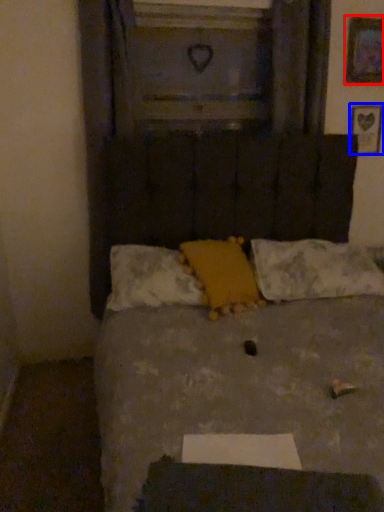
Question: Which object appears closest to the camera in this image, picture frame (highlighted by a red box) or picture frame (highlighted by a blue box)?

Choices:
 (A) picture frame
 (B) picture frame

Answer: (A)